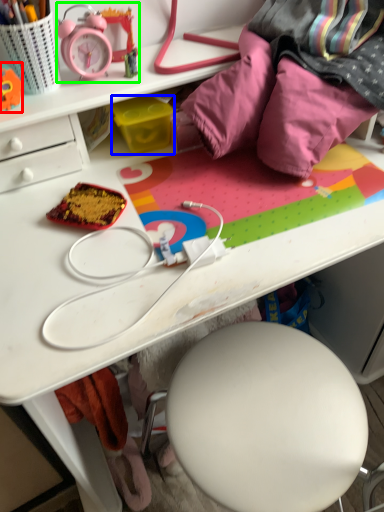
Question: Estimate the real-world distances between objects in this image. Which object is farther from toy (highlighted by a red box), stationery (highlighted by a blue box) or stationery (highlighted by a green box)?

Choices:
 (A) stationery
 (B) stationery

Answer: (A)